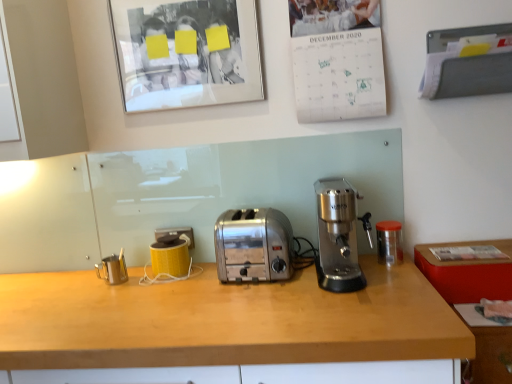
The width and height of the screenshot is (512, 384). I want to click on free space that is in between yellow matte mug at center, which is the second appliance from right to left, and brushed metal milk frother at left, which appears as the first appliance when viewed from the left, so click(x=139, y=274).